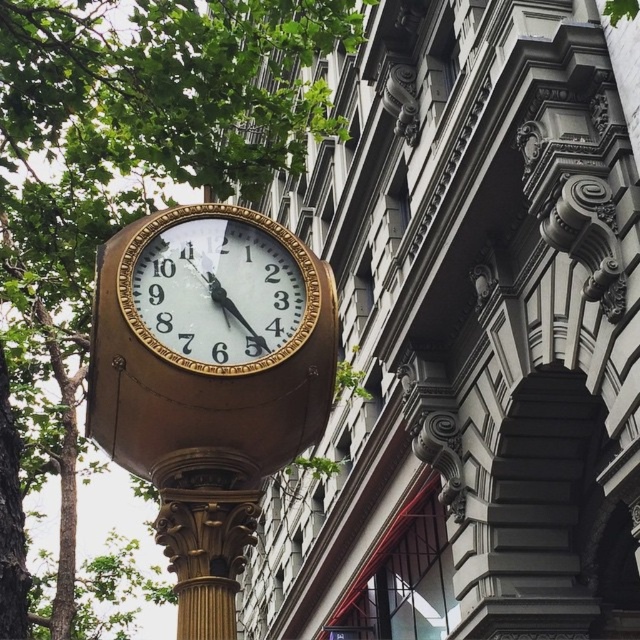
You are standing on the sidewalk in front of the building and see the green leafy tree at upper left and the gold polished clock at center. Which object appears taller in the image?

The green leafy tree at upper left appears much taller than the gold polished clock at center in the image.

You are a city planner assessing the visibility of the gold polished clock at center from the street below. Considering the green leafy tree at upper left, could the tree potentially block the view of the clock?

The green leafy tree at upper left might be wider than the gold polished clock at center, so it could potentially block the view of the clock depending on its exact placement and the tree canopy spread.